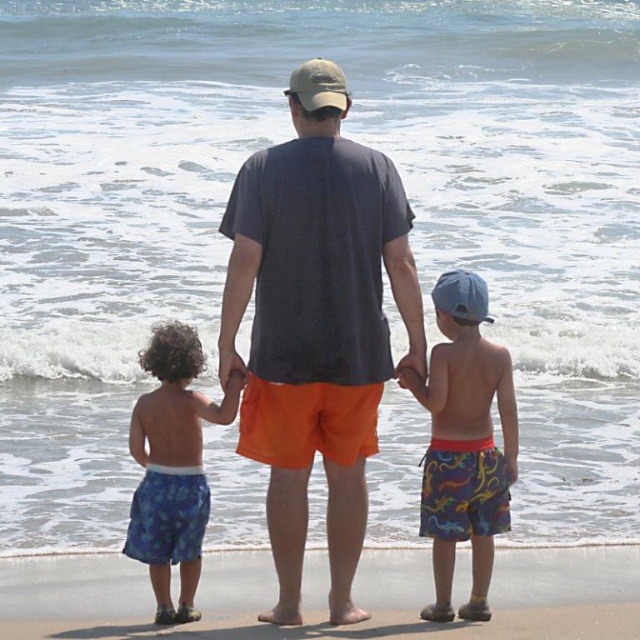
Question: Which of the following is the farthest from the observer?

Choices:
 (A) sandy beach at lower center
 (B) multicolored swim trunks at center
 (C) blue printed shorts at left
 (D) orange cotton shorts at center

Answer: (D)

Question: Does orange cotton shorts at center have a greater width compared to khaki fabric baseball cap at center?

Choices:
 (A) yes
 (B) no

Answer: (B)

Question: Is sandy beach at lower center positioned before khaki fabric baseball cap at center?

Choices:
 (A) yes
 (B) no

Answer: (A)

Question: Is orange cotton shorts at center closer to the viewer compared to khaki fabric baseball cap at center?

Choices:
 (A) yes
 (B) no

Answer: (B)

Question: Which object is closer to the camera taking this photo?

Choices:
 (A) khaki fabric baseball cap at center
 (B) blue fabric baseball cap at upper center

Answer: (B)

Question: Which of the following is the closest to the observer?

Choices:
 (A) [321, 99]
 (B) [253, 624]
 (C) [204, 358]

Answer: (B)